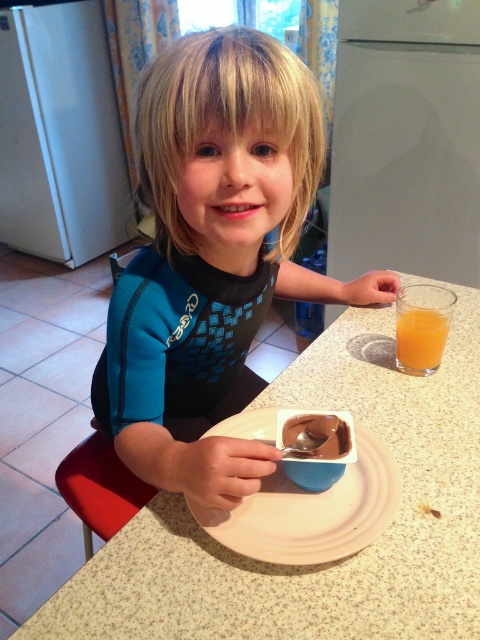
Can you confirm if blue matte shirt at center is taller than metallic spoon at plate center?

Yes, blue matte shirt at center is taller than metallic spoon at plate center.

Is point (179, 259) in front of point (350, 445)?

No, it is not.

Does point (183, 180) come behind point (307, 420)?

No, (183, 180) is closer to viewer.

Locate an element on the screen. The width and height of the screenshot is (480, 640). blue matte shirt at center is located at coordinates (213, 252).

Find the location of `blue matte shirt at center`. blue matte shirt at center is located at coordinates (213, 252).

Is blue matte shirt at center shorter than white speckled table at center?

In fact, blue matte shirt at center may be taller than white speckled table at center.

Who is more distant from viewer, (290, 285) or (169, 541)?

Positioned behind is point (290, 285).

Locate an element on the screen. blue matte shirt at center is located at coordinates (213, 252).

Is white speckled table at center bigger than white matte plate at center?

Yes, white speckled table at center is bigger than white matte plate at center.

Which is behind, point (199, 576) or point (269, 416)?

The point (269, 416) is more distant.

The height and width of the screenshot is (640, 480). In order to click on white speckled table at center in this screenshot , I will do `click(334, 563)`.